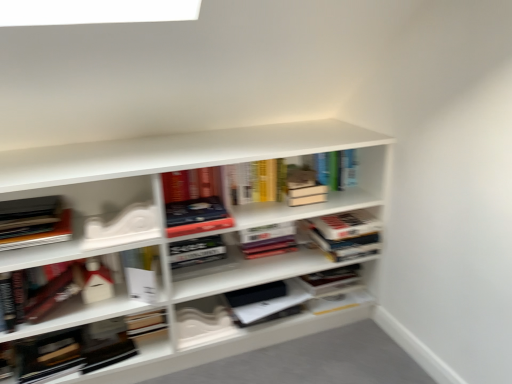
Question: Is the position of hardcover book at center, arranged as the 4th book when viewed from the left, more distant than that of hardcover book at upper center, the second book positioned from the right?

Choices:
 (A) no
 (B) yes

Answer: (A)

Question: Is hardcover book at center, arranged as the 4th book when viewed from the left, bigger than hardcover book at upper center, the second book positioned from the right?

Choices:
 (A) yes
 (B) no

Answer: (B)

Question: Is hardcover book at center, which is the third book from right to left, facing away from hardcover book at upper center, arranged as the 5th book when viewed from the left?

Choices:
 (A) no
 (B) yes

Answer: (A)

Question: Would you say hardcover book at center, arranged as the 4th book when viewed from the left, contains hardcover book at upper center, the second book positioned from the right?

Choices:
 (A) no
 (B) yes

Answer: (A)

Question: Does hardcover book at center, arranged as the 4th book when viewed from the left, have a greater height compared to hardcover book at upper center, the second book positioned from the right?

Choices:
 (A) no
 (B) yes

Answer: (A)

Question: Is hardcover book at center, which is the third book from right to left, facing towards hardcover book at upper center, the second book positioned from the right?

Choices:
 (A) no
 (B) yes

Answer: (A)

Question: Can you confirm if white paper at center, which is the third book from left to right, is taller than white matte box at left, the fifth book viewed from the right?

Choices:
 (A) yes
 (B) no

Answer: (B)

Question: Is white paper at center, which appears as the fourth book when viewed from the right, far away from white matte box at left, the fifth book viewed from the right?

Choices:
 (A) no
 (B) yes

Answer: (A)

Question: Is white paper at center, which is the third book from left to right, bigger than white matte box at left, acting as the 2th book starting from the left?

Choices:
 (A) no
 (B) yes

Answer: (A)

Question: From the image's perspective, is white paper at center, which is the third book from left to right, over white matte box at left, acting as the 2th book starting from the left?

Choices:
 (A) yes
 (B) no

Answer: (B)

Question: Is white paper at center, which appears as the fourth book when viewed from the right, beside white matte box at left, acting as the 2th book starting from the left?

Choices:
 (A) yes
 (B) no

Answer: (B)

Question: Is white paper at center, which appears as the fourth book when viewed from the right, positioned in front of white matte box at left, the fifth book viewed from the right?

Choices:
 (A) no
 (B) yes

Answer: (B)

Question: Is hardcover book at center, which is the first book in right-to-left order, to the left of white matte bookshelf at center from the viewer's perspective?

Choices:
 (A) no
 (B) yes

Answer: (A)